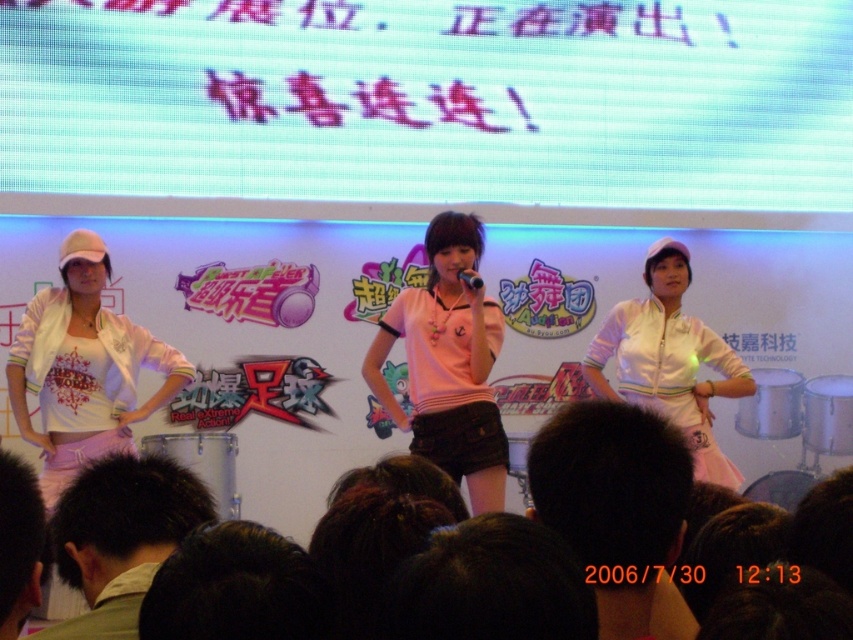
Question: Which of these objects is positioned farthest from the pink fabric shirt at center?

Choices:
 (A) light brown hair at center
 (B) white matte jacket at center

Answer: (A)

Question: Which of these objects is positioned farthest from the black matte microphone at center?

Choices:
 (A) pink fabric shirt at center
 (B) dark green hair at lower left

Answer: (B)

Question: Does dark green hair at lower left lie behind white matte jacket at center?

Choices:
 (A) yes
 (B) no

Answer: (B)

Question: Which of these objects is positioned closest to the black matte microphone at center?

Choices:
 (A) dark green hair at lower left
 (B) white matte projection screen at upper center
 (C) pink fabric shirt at center
 (D) white matte jacket at left

Answer: (C)

Question: Can you confirm if light brown hair at center is positioned below white matte jacket at center?

Choices:
 (A) no
 (B) yes

Answer: (B)

Question: Does dark green hair at lower left come behind black matte microphone at center?

Choices:
 (A) yes
 (B) no

Answer: (B)